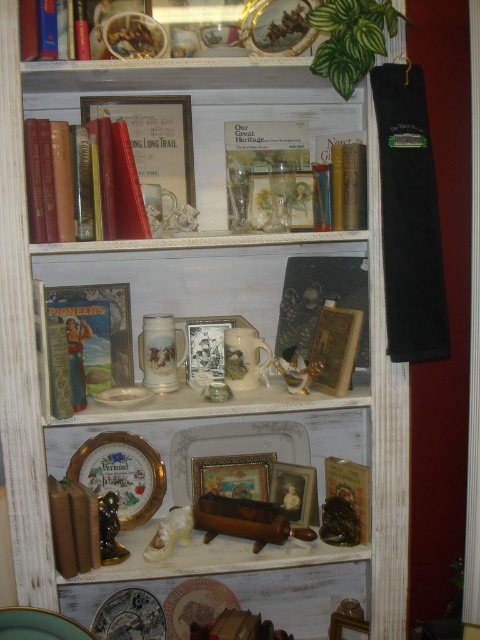
Question: Does white porcelain figurine at center have a smaller size compared to porcelain figurine at center?

Choices:
 (A) yes
 (B) no

Answer: (B)

Question: From the image, what is the correct spatial relationship of matte red book at upper left in relation to shiny gold figurine at lower left?

Choices:
 (A) right
 (B) left

Answer: (B)

Question: Is shiny gold figurine at lower left above porcelain figurine at center?

Choices:
 (A) yes
 (B) no

Answer: (B)

Question: Which object is farther from the camera taking this photo?

Choices:
 (A) gold metallic plate at center
 (B) matte ceramic mug at center
 (C) porcelain figurine at center

Answer: (A)

Question: Which point is closer to the camera?

Choices:
 (A) white glossy plate at center
 (B) matte gold book at center

Answer: (A)

Question: Which of the following is the farthest from the observer?

Choices:
 (A) click(x=344, y=296)
 (B) click(x=4, y=618)
 (C) click(x=58, y=212)
 (D) click(x=183, y=509)

Answer: (A)